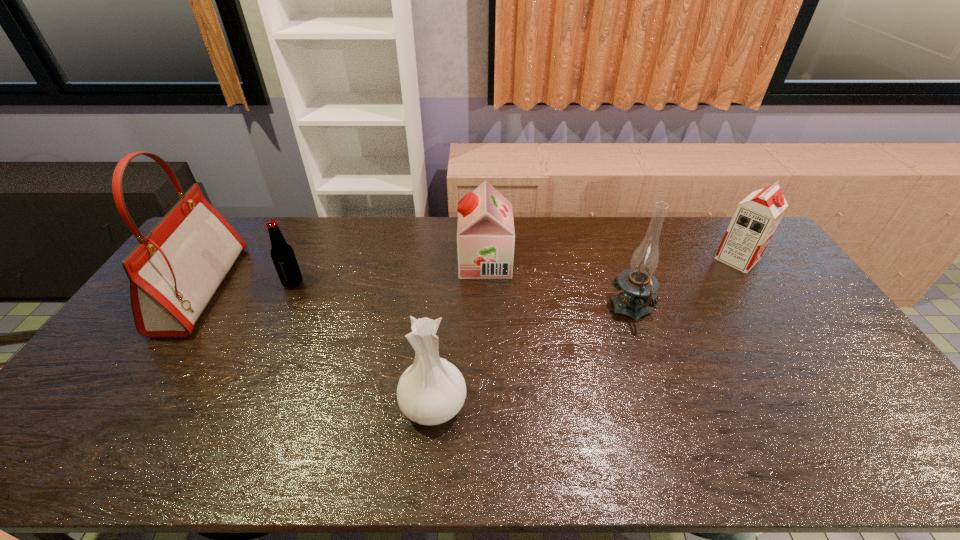
In order to click on handbag in this screenshot , I will do `click(174, 272)`.

You are a GUI agent. You are given a task and a screenshot of the screen. Output one action in this format:
    pyautogui.click(x=<x>, y=<y>)
    Task: Click on the tallest object
    This screenshot has width=960, height=540.
    Given the screenshot: What is the action you would take?
    pyautogui.click(x=174, y=272)

Locate an element on the screen. oil lamp is located at coordinates (639, 286).

Identify the location of the second object from right to left. The width and height of the screenshot is (960, 540). (639, 286).

Identify the location of the rightmost object. This screenshot has width=960, height=540. (756, 218).

Locate an element on the screen. The height and width of the screenshot is (540, 960). the left soya milk is located at coordinates (485, 232).

Identify the location of vase. click(x=431, y=391).

This screenshot has width=960, height=540. In order to click on beer bottle in this screenshot , I will do `click(282, 254)`.

Image resolution: width=960 pixels, height=540 pixels. Identify the location of the shortest object. (282, 254).

Image resolution: width=960 pixels, height=540 pixels. I want to click on vacant point located on the front of the tallest object, so (112, 421).